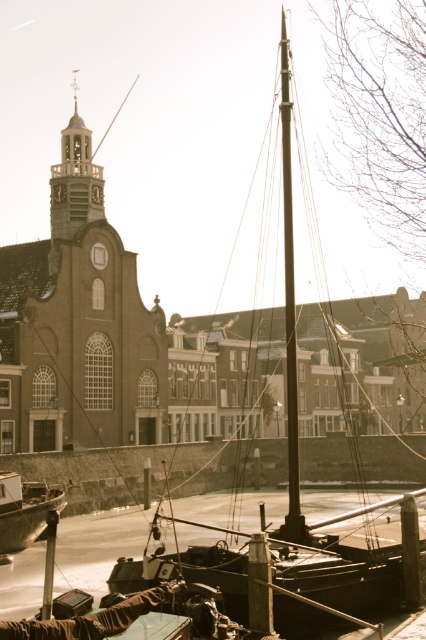
Which is below, black polished wood mast at center or wooden boat at lower left?

wooden boat at lower left is below.

Does black polished wood mast at center appear on the left side of wooden boat at lower left?

Incorrect, black polished wood mast at center is not on the left side of wooden boat at lower left.

I want to click on black polished wood mast at center, so pos(290,307).

Does wooden sailboat at center appear over gold textured clock tower at upper left?

No.

Is point (385, 173) positioned in front of point (77, 150)?

No, it is not.

Does point (408, 28) come in front of point (95, 211)?

No, (408, 28) is further to viewer.

Locate an element on the screen. Image resolution: width=426 pixels, height=640 pixels. wooden sailboat at center is located at coordinates (290, 300).

Between wooden sailboat at center and wooden boat at lower left, which one is positioned higher?

wooden sailboat at center

Can you confirm if wooden sailboat at center is positioned below wooden boat at lower left?

No, wooden sailboat at center is not below wooden boat at lower left.

Is point (284, 33) closer to camera compared to point (55, 500)?

That is False.

Locate an element on the screen. wooden sailboat at center is located at coordinates (290, 300).